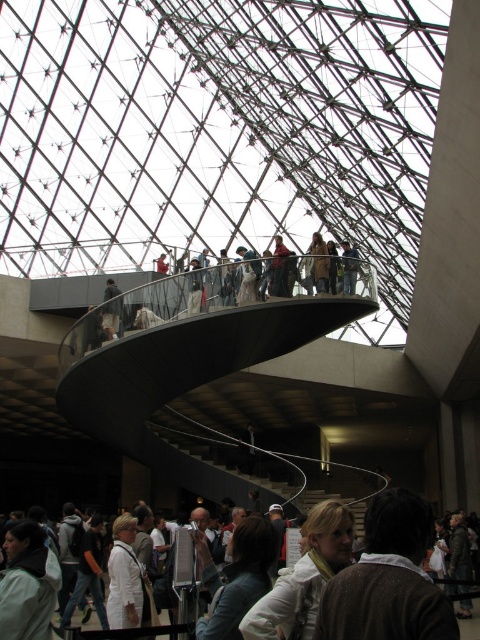
You are standing in the museum and want to take a photo of both the curved staircase and the group of people. The two points you need to focus on are point (420, 557) and point (116, 333). Since one is closer to you, will you need to adjust your camera focus to capture both clearly?

Point (420, 557) is closer to the camera than point (116, 333). To capture both clearly, you may need to adjust your camera focus since they are at different distances from the camera.

You are a visitor standing at the entrance of the museum and see the light brown hair at lower center and the light beige fabric jacket at upper center. Which object is closer to you?

The light brown hair at lower center is closer to you because it is positioned in front of the light beige fabric jacket at upper center.

In the scene shown: You are an interior designer observing the modern architectural structure. You notice the white fabric scarf at center and the light beige fabric jacket at upper center. Which object is located lower in the scene?

The white fabric scarf at center is positioned under the light beige fabric jacket at upper center, so it is located lower in the scene.